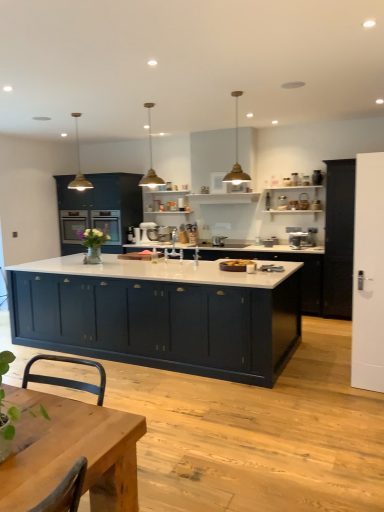
At what (x,y) coordinates should I click in order to perform the action: click on satin silver toaster at center. Please return your answer as a coordinate pair (x, y). The image size is (384, 512). Looking at the image, I should click on (219, 241).

The image size is (384, 512). What do you see at coordinates (161, 233) in the screenshot?
I see `satin silver mixer at center, which is the 1th appliance from front to back` at bounding box center [161, 233].

Find the location of `green leafy plant at lower left`. green leafy plant at lower left is located at coordinates (3, 389).

Describe the element at coordinates (3, 389) in the screenshot. I see `green leafy plant at lower left` at that location.

Locate an element on the screen. satin silver toaster at center is located at coordinates (219, 241).

From the image's perspective, is white matte stand mixer at center, which is the 2th appliance in right-to-left order, positioned above or below satin silver toaster at center?

white matte stand mixer at center, which is the 2th appliance in right-to-left order, is above satin silver toaster at center.

Would you consider white matte stand mixer at center, the 2th appliance when ordered from front to back, to be distant from satin silver toaster at center?

white matte stand mixer at center, the 2th appliance when ordered from front to back, is actually quite close to satin silver toaster at center.

Is white matte stand mixer at center, which appears as the 1th appliance when viewed from the left, bigger than satin silver toaster at center?

Yes, white matte stand mixer at center, which appears as the 1th appliance when viewed from the left, is bigger than satin silver toaster at center.

Considering the relative positions of white matte stand mixer at center, which is the 2th appliance in right-to-left order, and satin silver toaster at center in the image provided, is white matte stand mixer at center, which is the 2th appliance in right-to-left order, to the right of satin silver toaster at center from the viewer's perspective?

No.

Consider the image. Is satin silver mixer at center, which ranks as the first appliance in right-to-left order, oriented away from white matte stand mixer at center, the 2th appliance when ordered from front to back?

satin silver mixer at center, which ranks as the first appliance in right-to-left order, is not turned away from white matte stand mixer at center, the 2th appliance when ordered from front to back.

Is satin silver mixer at center, which is the second appliance from left to right, to the right of white matte stand mixer at center, the 2th appliance when ordered from front to back, from the viewer's perspective?

Yes.

How different are the orientations of satin silver mixer at center, the second appliance in the back-to-front sequence, and white matte stand mixer at center, which appears as the 1th appliance when viewed from the left, in degrees?

satin silver mixer at center, the second appliance in the back-to-front sequence, and white matte stand mixer at center, which appears as the 1th appliance when viewed from the left, are facing 22.9 degrees away from each other.

Considering the sizes of objects satin silver mixer at center, which is the 1th appliance from front to back, and white matte stand mixer at center, which is the 2th appliance in right-to-left order, in the image provided, who is wider, satin silver mixer at center, which is the 1th appliance from front to back, or white matte stand mixer at center, which is the 2th appliance in right-to-left order,?

With larger width is satin silver mixer at center, which is the 1th appliance from front to back.

How far apart are satin silver mixer at center, which is the second appliance from left to right, and white matte door at right?

7.98 feet.

Are satin silver mixer at center, which ranks as the first appliance in right-to-left order, and white matte door at right making contact?

There is a gap between satin silver mixer at center, which ranks as the first appliance in right-to-left order, and white matte door at right.

In order to click on screen door on the right side of satin silver mixer at center, the second appliance in the back-to-front sequence in this screenshot , I will do [x=368, y=274].

Considering the sizes of satin silver mixer at center, which is the 1th appliance from front to back, and white matte door at right in the image, is satin silver mixer at center, which is the 1th appliance from front to back, wider or thinner than white matte door at right?

In the image, satin silver mixer at center, which is the 1th appliance from front to back, appears to be wider than white matte door at right.

Between point (254, 250) and point (93, 458), which one is positioned in front?

The point (93, 458) is closer to the camera.

Is matte blue cabinets at center, which is the 2th cabinetry from back to front, surrounding wooden table at center?

No, matte blue cabinets at center, which is the 2th cabinetry from back to front, does not contain wooden table at center.

What's the angular difference between matte blue cabinets at center, the 3th cabinetry when ordered from front to back, and wooden table at center's facing directions?

The angle between the facing direction of matte blue cabinets at center, the 3th cabinetry when ordered from front to back, and the facing direction of wooden table at center is 0.622 degrees.

Based on the photo, in the image, is matte blue cabinets at center, which is the 2th cabinetry from back to front, on the left side or the right side of wooden table at center?

From the image, it's evident that matte blue cabinets at center, which is the 2th cabinetry from back to front, is to the right of wooden table at center.

Who is smaller, matte dark blue cabinet at center, arranged as the 4th cabinetry when viewed from the back, or wooden table at center?

wooden table at center is smaller.

Consider the image. Can you confirm if matte dark blue cabinet at center, which appears as the first cabinetry when viewed from the front, is thinner than wooden table at center?

No.

From a real-world perspective, which is physically below, matte dark blue cabinet at center, arranged as the 4th cabinetry when viewed from the back, or wooden table at center?

In real-world perspective, matte dark blue cabinet at center, arranged as the 4th cabinetry when viewed from the back, is lower.

Is matte dark blue cabinet at center, which appears as the first cabinetry when viewed from the front, taller or shorter than wooden table at center?

In the image, matte dark blue cabinet at center, which appears as the first cabinetry when viewed from the front, appears to be taller than wooden table at center.

Consider the image. From a real-world perspective, between matte dark blue cabinet at center, which appears as the first cabinetry when viewed from the front, and satin silver mixer at center, which is the 1th appliance from front to back, who is vertically lower?

From a 3D spatial view, matte dark blue cabinet at center, which appears as the first cabinetry when viewed from the front, is below.

Which of these two, matte dark blue cabinet at center, arranged as the 4th cabinetry when viewed from the back, or satin silver mixer at center, which is the 1th appliance from front to back, is thinner?

satin silver mixer at center, which is the 1th appliance from front to back, is thinner.

Between matte dark blue cabinet at center, arranged as the 4th cabinetry when viewed from the back, and satin silver mixer at center, which is the second appliance from left to right, which one has larger size?

With larger size is matte dark blue cabinet at center, arranged as the 4th cabinetry when viewed from the back.

Does white matte stand mixer at center, which is the 2th appliance in right-to-left order, have a lesser height compared to matte blue cabinets at center, which is the 2th cabinetry from back to front?

Yes.

The height and width of the screenshot is (512, 384). Identify the location of the 2nd appliance to the left when counting from the matte blue cabinets at center, which is the 2th cabinetry from back to front. (144, 231).

In the scene shown: Is white matte stand mixer at center, the first appliance from the back, inside or outside of matte blue cabinets at center, which is the 2th cabinetry from back to front?

white matte stand mixer at center, the first appliance from the back, is located inside matte blue cabinets at center, which is the 2th cabinetry from back to front.

Can you confirm if white matte stand mixer at center, which is the 2th appliance in right-to-left order, is thinner than matte blue cabinets at center, the 3th cabinetry when ordered from front to back?

Correct, the width of white matte stand mixer at center, which is the 2th appliance in right-to-left order, is less than that of matte blue cabinets at center, the 3th cabinetry when ordered from front to back.

There is a satin silver toaster at center. Where is `the 2nd appliance above it (from the image's perspective)`? The height and width of the screenshot is (512, 384). the 2nd appliance above it (from the image's perspective) is located at coordinates (144, 231).

You are a GUI agent. You are given a task and a screenshot of the screen. Output one action in this format:
    pyautogui.click(x=<x>, y=<y>)
    Task: Click on the appliance located above the satin silver mixer at center, the second appliance in the back-to-front sequence (from a real-world perspective)
    
    Given the screenshot: What is the action you would take?
    pyautogui.click(x=144, y=231)

Looking at the image, which one is located closer to satin silver mixer at center, which is the second appliance from left to right, matte dark blue cabinet at center, which appears as the first cabinetry when viewed from the front, or white matte door at right?

matte dark blue cabinet at center, which appears as the first cabinetry when viewed from the front, lies closer to satin silver mixer at center, which is the second appliance from left to right, than the other object.

Based on their spatial positions, is white matte door at right or white matte stand mixer at center, the 2th appliance when ordered from front to back, closer to matte dark blue cabinets at center, the 4th cabinetry viewed from the front?

white matte stand mixer at center, the 2th appliance when ordered from front to back, is positioned closer to the anchor matte dark blue cabinets at center, the 4th cabinetry viewed from the front.

Considering their positions, is green leafy plant at lower left positioned further to matte dark blue cabinets at center, the first cabinetry from the back, than matte blue cabinets at center, the 3th cabinetry when ordered from front to back?

green leafy plant at lower left.

From the image, which object appears to be farther from matte dark blue cabinets at center, the 4th cabinetry viewed from the front, satin silver toaster at center or white matte door at right?

The object further to matte dark blue cabinets at center, the 4th cabinetry viewed from the front, is white matte door at right.

Considering their positions, is matte dark blue cabinets at center, the 4th cabinetry viewed from the front, positioned closer to matte blue cabinets at center, which is the 2th cabinetry from back to front, than white matte stand mixer at center, which is the 2th appliance in right-to-left order?

white matte stand mixer at center, which is the 2th appliance in right-to-left order, lies closer to matte blue cabinets at center, which is the 2th cabinetry from back to front, than the other object.

Based on their spatial positions, is green leafy plant at lower left or matte blue cabinets at center, which is the 2th cabinetry from back to front, further from white matte stand mixer at center, the first appliance from the back?

green leafy plant at lower left lies further to white matte stand mixer at center, the first appliance from the back, than the other object.

Estimate the real-world distances between objects in this image. Which object is closer to satin silver toaster at center, matte dark blue cabinets at center, the first cabinetry from the back, or white matte door at right?

matte dark blue cabinets at center, the first cabinetry from the back, is closer to satin silver toaster at center.

From the image, which object appears to be farther from matte black cabinet at right, positioned as the 3th cabinetry in back-to-front order, satin silver mixer at center, which ranks as the first appliance in right-to-left order, or white matte door at right?

satin silver mixer at center, which ranks as the first appliance in right-to-left order.

At what (x,y) coordinates should I click in order to perform the action: click on table located between green leafy plant at lower left and matte black cabinet at right, which ranks as the second cabinetry in front-to-back order, in the depth direction. Please return your answer as a coordinate pair (x, y). This screenshot has height=512, width=384. Looking at the image, I should click on (71, 452).

Find the location of a particular element. This screenshot has width=384, height=512. table between green leafy plant at lower left and satin silver toaster at center along the z-axis is located at coordinates click(71, 452).

Identify the location of table between green leafy plant at lower left and matte dark blue cabinets at center, the first cabinetry from the back, from front to back. The height and width of the screenshot is (512, 384). (71, 452).

Identify the location of appliance located between white matte stand mixer at center, the 2th appliance when ordered from front to back, and matte black cabinet at right, which ranks as the second cabinetry in front-to-back order, in the left-right direction. The width and height of the screenshot is (384, 512). (161, 233).